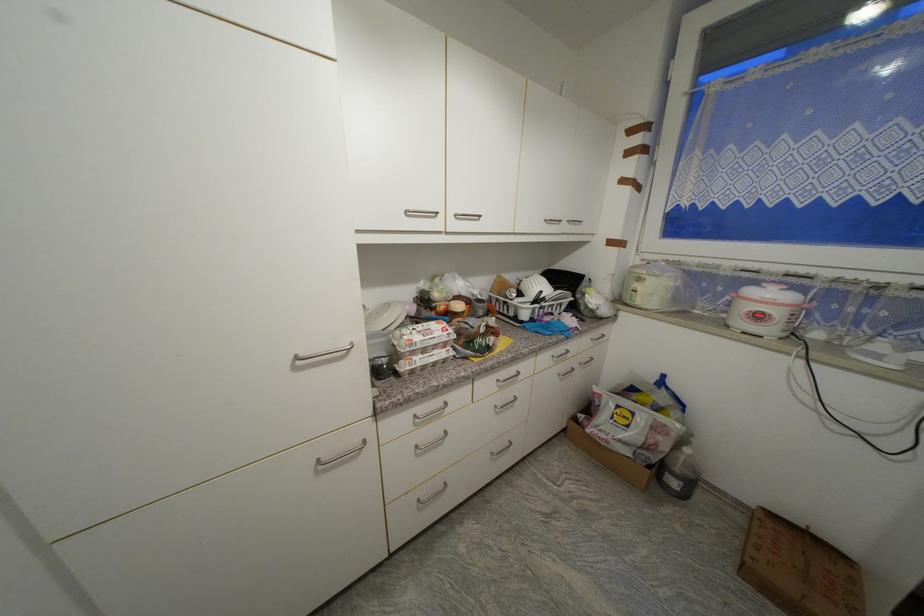
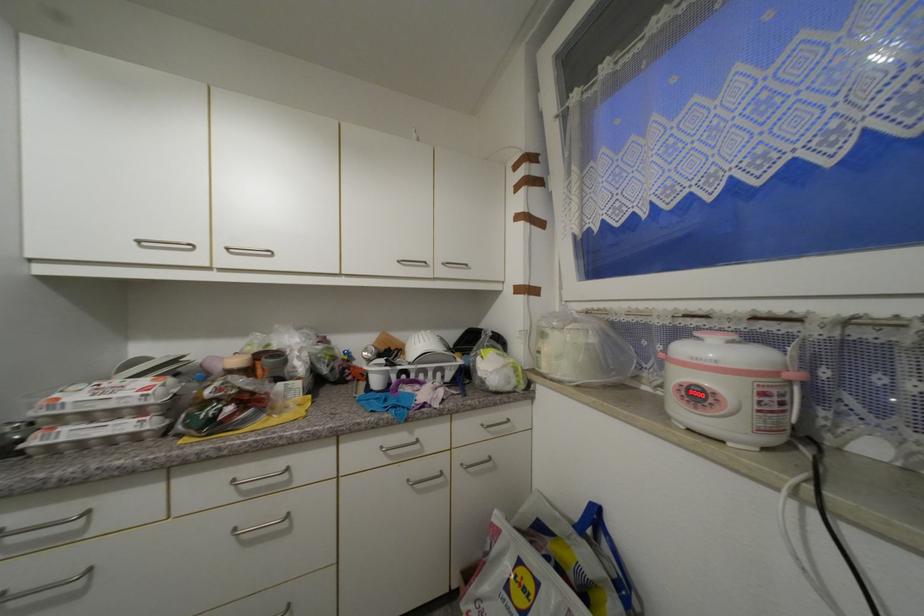
The point at [558,358] is marked in the first image. Where is the corresponding point in the second image?

(387, 448)